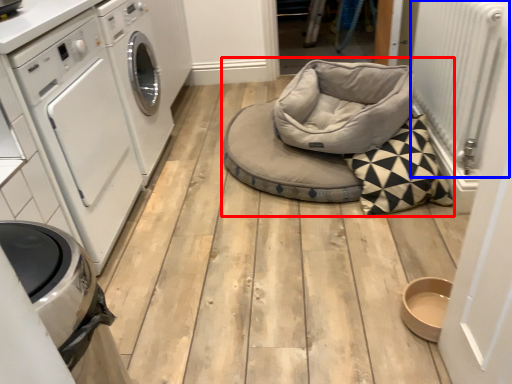
Question: Which point is further to the camera, daybed (highlighted by a red box) or radiator (highlighted by a blue box)?

Choices:
 (A) daybed
 (B) radiator

Answer: (A)